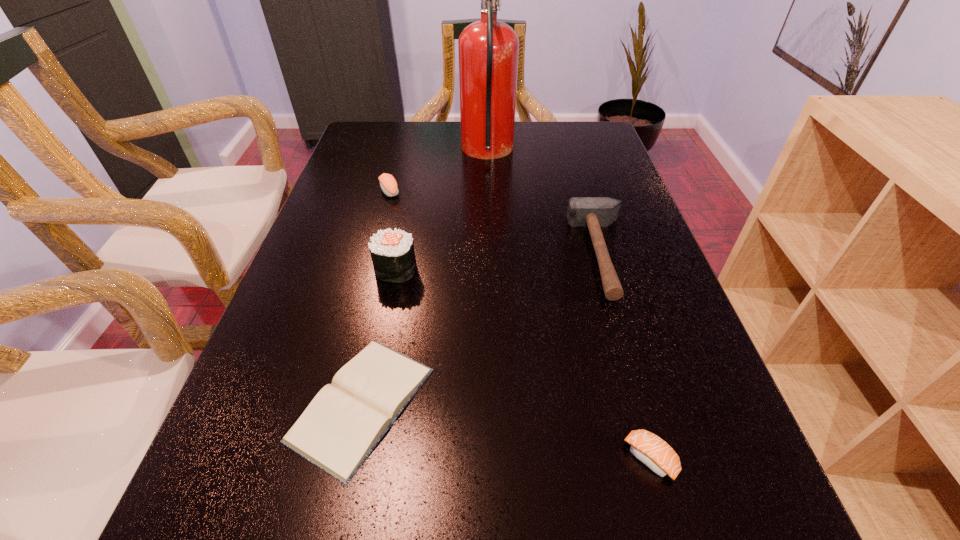
This screenshot has width=960, height=540. Find the location of `the tallest object`. the tallest object is located at coordinates (488, 50).

This screenshot has width=960, height=540. What are the coordinates of `the farthest object` in the screenshot? It's located at (488, 50).

Where is `the second nearest sushi`? the second nearest sushi is located at coordinates (392, 251).

At what (x,y) coordinates should I click in order to perform the action: click on the second tallest object. Please return your answer as a coordinate pair (x, y). The image size is (960, 540). Looking at the image, I should click on pos(392,251).

Find the location of `hammer`. hammer is located at coordinates (593, 212).

Image resolution: width=960 pixels, height=540 pixels. I want to click on the fourth tallest object, so click(x=388, y=184).

Where is `the second farthest object`? the second farthest object is located at coordinates (388, 184).

The height and width of the screenshot is (540, 960). In order to click on the rightmost sushi in this screenshot , I will do `click(651, 450)`.

This screenshot has width=960, height=540. Find the location of `the shortest sushi`. the shortest sushi is located at coordinates (651, 450).

Image resolution: width=960 pixels, height=540 pixels. Find the location of `Bible`. Bible is located at coordinates (345, 421).